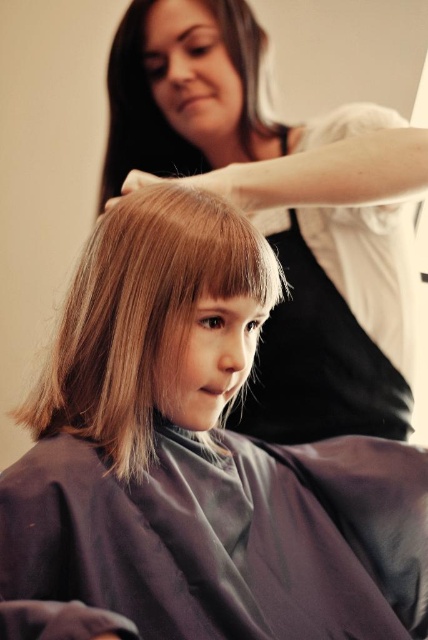
You are a customer in a hair salon and want to know where the matte white shirt at upper center is located. Can you describe its position relative to the other objects in the scene?

The matte white shirt at upper center is located at the coordinates point (x=232, y=115). However, since there are no other objects provided in the scene description to compare its position with, I cannot describe its position relative to other objects.

Looking at this image, you are a customer in the salon and want to point out the blonde hair at center to the stylist. Which direction should you indicate relative to the black fabric apron at upper center?

The blonde hair at center is to the left of the black fabric apron at upper center, so you should indicate the direction to the left of the black fabric apron at upper center.